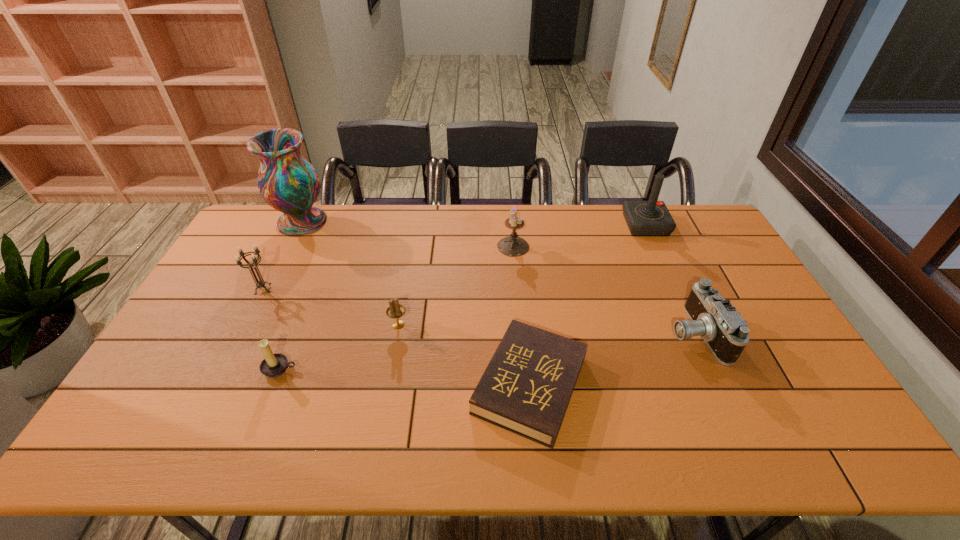
Find the location of `vacant space that satisfies the following two spatial constraints: 1. on the front side of the tallest object; 2. on the left side of the farthest candle holder`. vacant space that satisfies the following two spatial constraints: 1. on the front side of the tallest object; 2. on the left side of the farthest candle holder is located at coordinates (290, 246).